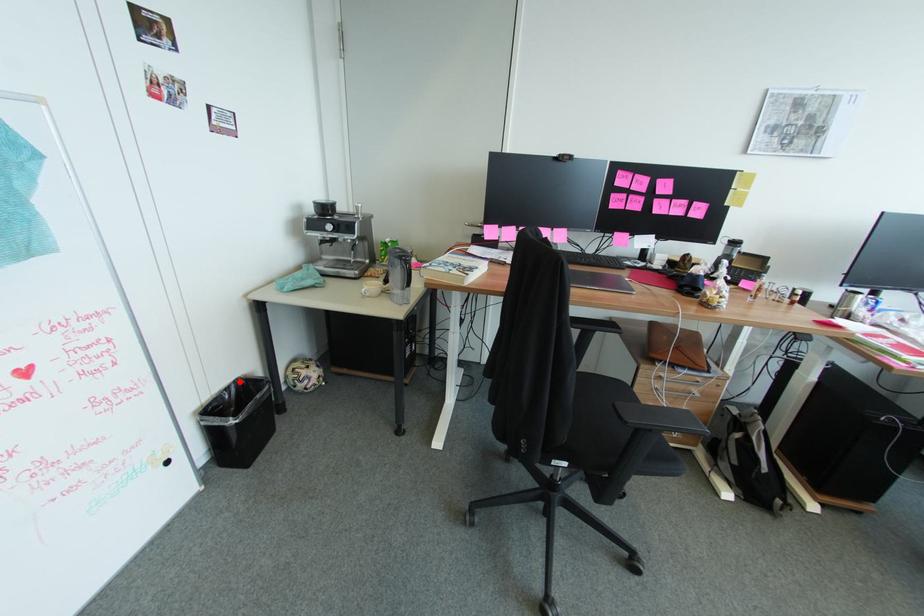
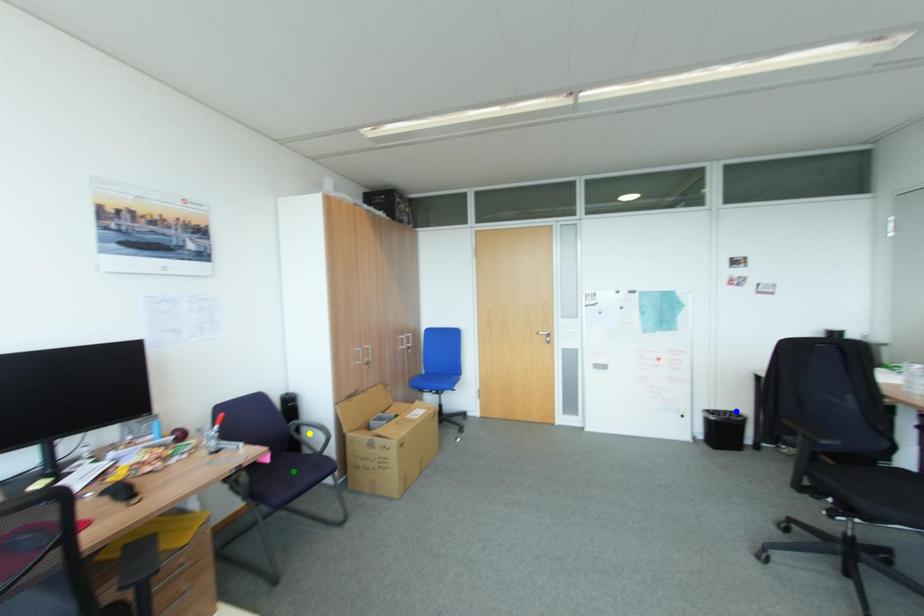
Question: I am providing you with two images of the same scene from different viewpoints. A red point is marked on the first image. You are given multiple points on the second image. Which point in image 2 is actually the same real-world point as the red point in image 1?

Choices:
 (A) yellow point
 (B) green point
 (C) blue point

Answer: (C)